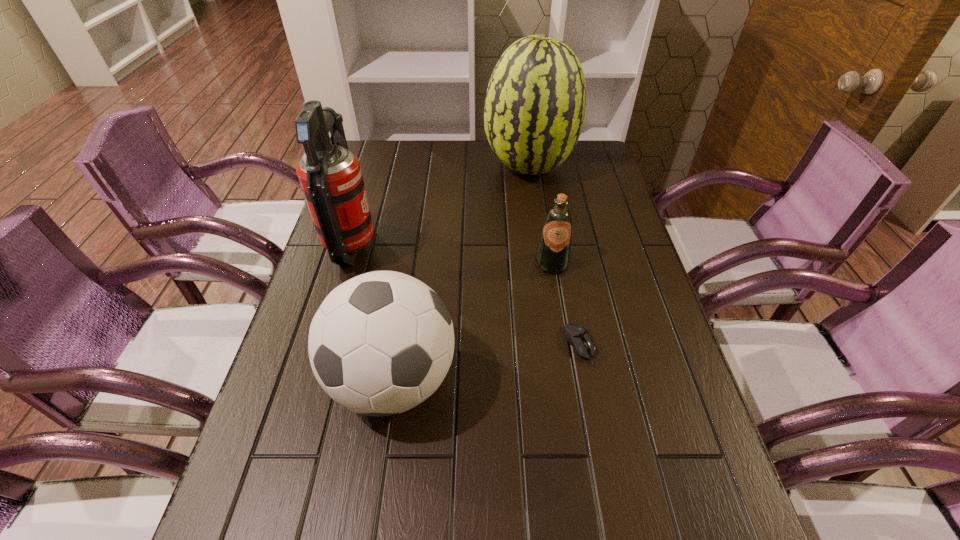
Identify the location of free space that satisfies the following two spatial constraints: 1. on the front label side of the fire extinguisher; 2. on the right side of the third shortest object. (312, 380).

Find the location of a particular element. Image resolution: width=960 pixels, height=540 pixels. vacant space that satisfies the following two spatial constraints: 1. on the front-facing side of the shortest object; 2. on the right side of the olive oil is located at coordinates (564, 345).

Identify the location of free space that satisfies the following two spatial constraints: 1. on the front label side of the fire extinguisher; 2. on the right side of the shortest object. This screenshot has width=960, height=540. (323, 345).